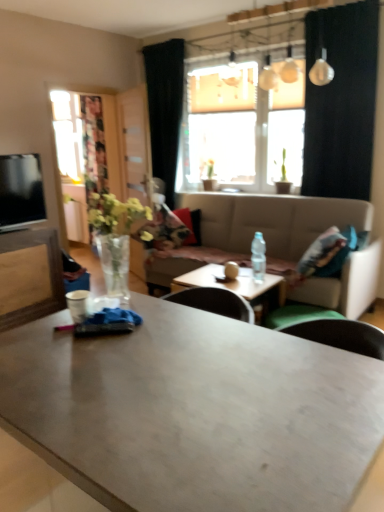
You are a GUI agent. You are given a task and a screenshot of the screen. Output one action in this format:
    pyautogui.click(x=<x>, y=<y>)
    Task: Click on the empty space that is ontop of matte gray coffee table at center, which is counted as the first coffee table, starting from the front (from a real-world perspective)
    
    Given the screenshot: What is the action you would take?
    pyautogui.click(x=165, y=373)